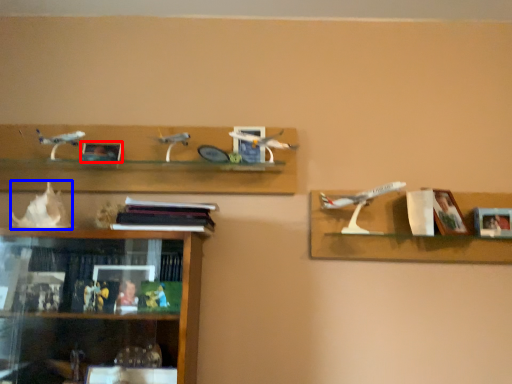
Question: Which point is further to the camera, picture frame (highlighted by a red box) or toy (highlighted by a blue box)?

Choices:
 (A) picture frame
 (B) toy

Answer: (A)